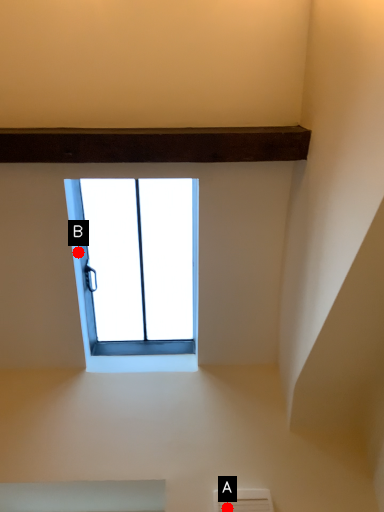
Question: Two points are circled on the image, labeled by A and B beside each circle. Which of the following is the closest to the observer?

Choices:
 (A) A is closer
 (B) B is closer

Answer: (A)